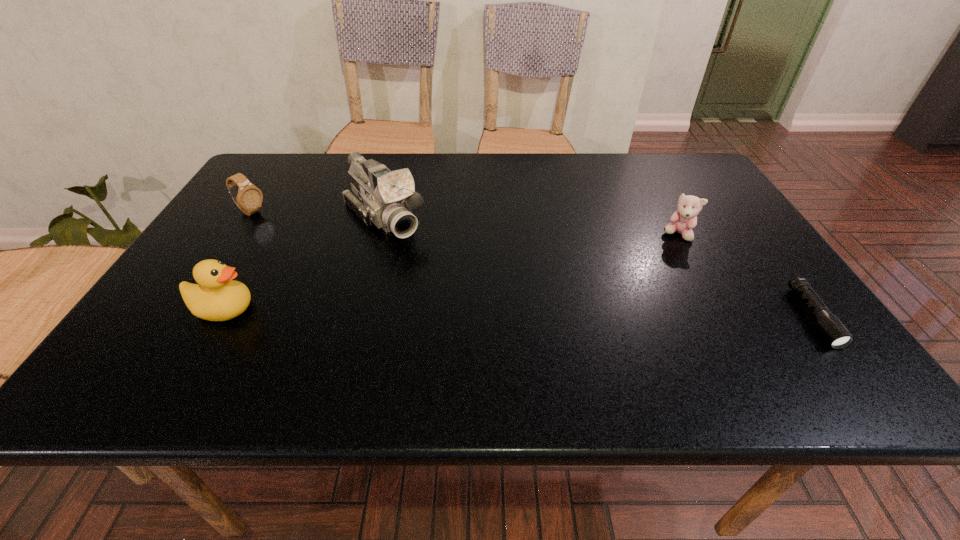
At what (x,y) coordinates should I click in order to perform the action: click on duck at the left edge. Please return your answer as a coordinate pair (x, y). This screenshot has width=960, height=540. Looking at the image, I should click on (217, 297).

At what (x,y) coordinates should I click in order to perform the action: click on watch located in the left edge section of the desktop. Please return your answer as a coordinate pair (x, y). The image size is (960, 540). Looking at the image, I should click on (248, 198).

Identify the location of flashlight that is at the right edge. (835, 333).

Where is `teddy bear present at the right edge`? The height and width of the screenshot is (540, 960). teddy bear present at the right edge is located at coordinates (683, 220).

Find the location of `object located at the near left corner`. object located at the near left corner is located at coordinates (217, 297).

Locate an element on the screen. This screenshot has height=540, width=960. object positioned at the near right corner is located at coordinates (835, 333).

Locate an element on the screen. vacant area at the far edge is located at coordinates (533, 179).

The height and width of the screenshot is (540, 960). In the image, there is a desktop. What are the coordinates of `vacant space at the near edge` in the screenshot? It's located at (556, 327).

This screenshot has height=540, width=960. What are the coordinates of `free space at the left edge` in the screenshot? It's located at (194, 261).

Find the location of a particular element. This screenshot has width=960, height=540. vacant position at the far right corner of the desktop is located at coordinates (655, 160).